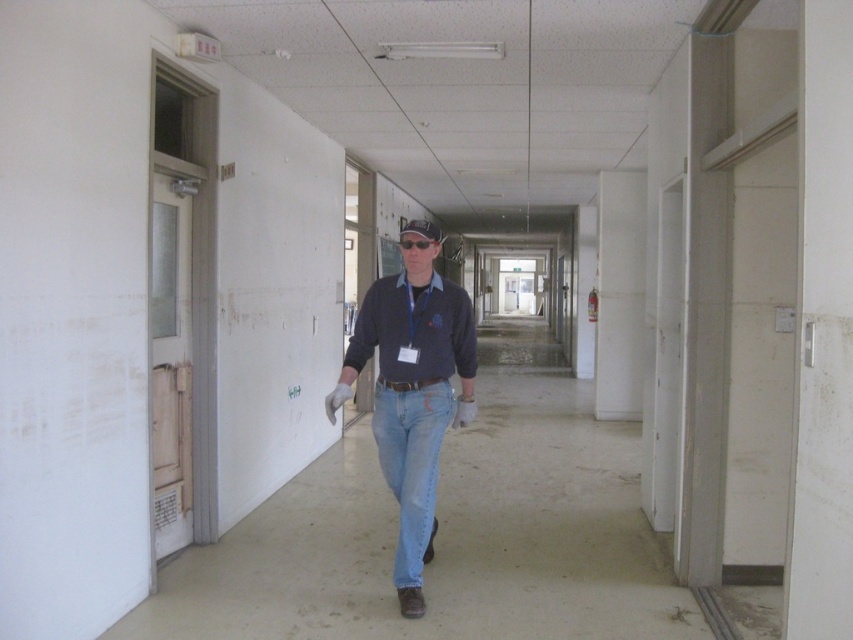
Is blue denim jeans at center above light blue denim jeans at center?

Correct, blue denim jeans at center is located above light blue denim jeans at center.

Who is positioned more to the left, blue denim jeans at center or light blue denim jeans at center?

Positioned to the left is blue denim jeans at center.

Is point (422, 609) positioned after point (403, 552)?

No.

At what (x,y) coordinates should I click in order to perform the action: click on blue denim jeans at center. Please return your answer as a coordinate pair (x, y). Looking at the image, I should click on (412, 388).

Does blue denim jeans at center have a greater height compared to dark blue sweater at center?

Correct, blue denim jeans at center is much taller as dark blue sweater at center.

Is blue denim jeans at center below dark blue sweater at center?

Yes.

Which is in front, point (389, 394) or point (427, 364)?

Point (427, 364) is in front.

Identify the location of blue denim jeans at center. (412, 388).

In the scene shown: Does dark blue sweater at center appear under light blue denim jeans at center?

Actually, dark blue sweater at center is above light blue denim jeans at center.

In the scene shown: Does dark blue sweater at center have a lesser width compared to light blue denim jeans at center?

Incorrect, dark blue sweater at center's width is not less than light blue denim jeans at center's.

This screenshot has width=853, height=640. What do you see at coordinates (415, 330) in the screenshot?
I see `dark blue sweater at center` at bounding box center [415, 330].

At what (x,y) coordinates should I click in order to perform the action: click on dark blue sweater at center. Please return your answer as a coordinate pair (x, y). Looking at the image, I should click on (x=415, y=330).